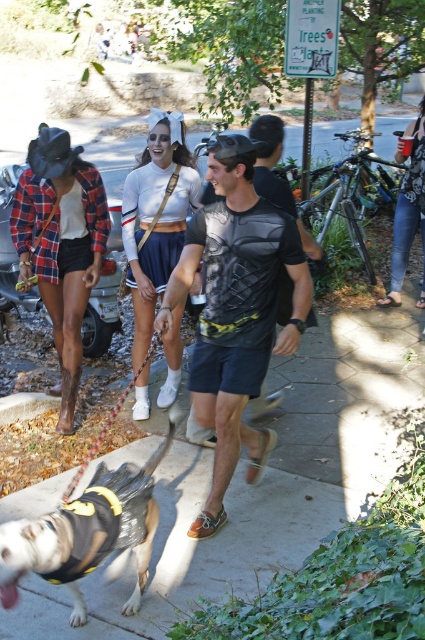
You are standing at the point marked as point (x=61, y=244) in the image. What is the color of the clothing item you are currently touching?

The point (x=61, y=244) is on plaid flannel shirt at left, so the color of the clothing item you are currently touching is plaid flannel.

You are a photographer standing at the edge of the scene. You want to capture a photo where both the black mesh shirt at center and the black fabric dog at center are in focus. The camera you are using has a depth of field that can cover 35 inches. Will both subjects be in focus?

The black mesh shirt at center is 36.05 inches from the black fabric dog at center. Since the distance between them exceeds the camera depth of field of 35 inches, both subjects may not be in focus simultaneously.